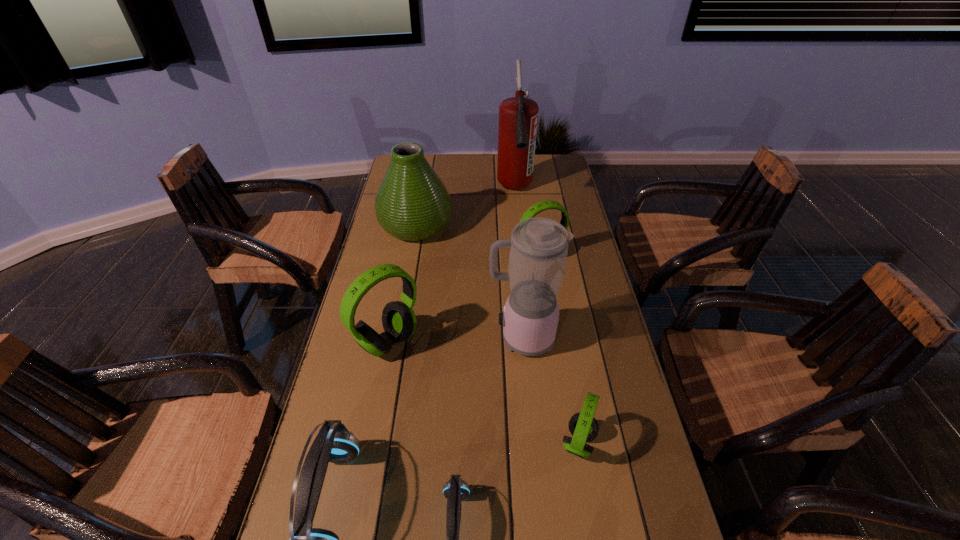
Locate an element on the screen. Image resolution: width=960 pixels, height=540 pixels. red fire extinguisher is located at coordinates (518, 116).

Where is `fire extinguisher`? fire extinguisher is located at coordinates (518, 116).

Find the location of a particular element. food processor is located at coordinates (538, 251).

Find the location of a particular element. The width and height of the screenshot is (960, 540). green vase is located at coordinates (412, 204).

The height and width of the screenshot is (540, 960). In order to click on the second farthest headset in this screenshot , I will do `click(399, 322)`.

At what (x,y) coordinates should I click in order to perform the action: click on the biggest green headset. Please return your answer as a coordinate pair (x, y). Image resolution: width=960 pixels, height=540 pixels. Looking at the image, I should click on (399, 322).

Identify the location of the farthest headset. (544, 205).

Find the location of a particular element. the farthest green headset is located at coordinates (544, 205).

Where is `the smallest green headset`? the smallest green headset is located at coordinates (583, 426).

Where is `the second shortest object`? This screenshot has width=960, height=540. the second shortest object is located at coordinates (583, 426).